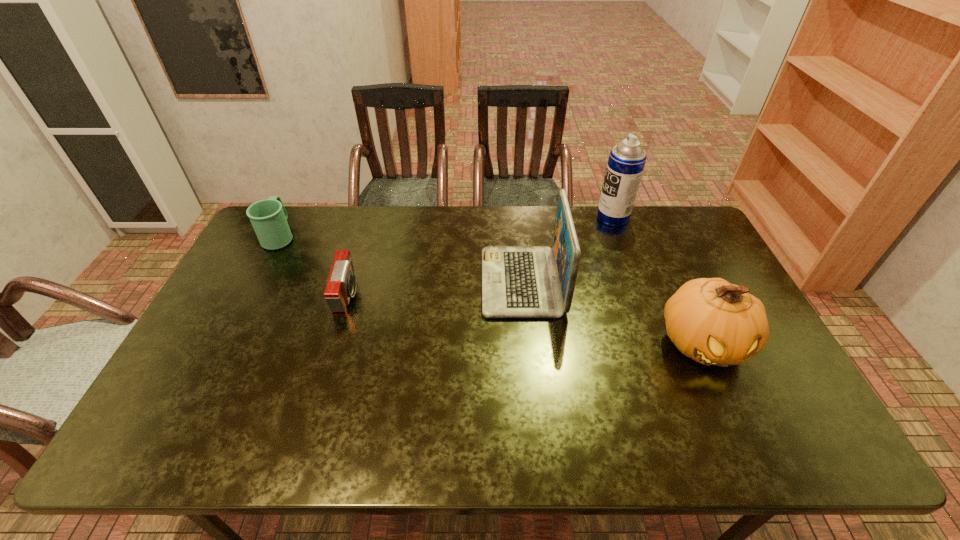
Where is `aerosol can`? This screenshot has height=540, width=960. aerosol can is located at coordinates (626, 162).

You are a GUI agent. You are given a task and a screenshot of the screen. Output one action in this format:
    pyautogui.click(x=<x>, y=<y>)
    Task: Click on the laptop computer
    Image resolution: width=960 pixels, height=540 pixels.
    Given the screenshot: What is the action you would take?
    pyautogui.click(x=517, y=282)

The height and width of the screenshot is (540, 960). Identify the location of pumpkin. (714, 322).

Where is `the second shortest object`? The width and height of the screenshot is (960, 540). the second shortest object is located at coordinates (268, 217).

What are the coordinates of `the leftmost object` in the screenshot? It's located at (268, 217).

Identify the location of the fourth object from right to left. tap(341, 285).

Find the location of a particular element. This screenshot has height=540, width=960. the shortest object is located at coordinates (341, 285).

This screenshot has height=540, width=960. I want to click on blank area located on the label side of the aerosol can, so click(x=510, y=217).

Where is `vacant space situated on the label side of the aerosol can`? vacant space situated on the label side of the aerosol can is located at coordinates (547, 217).

Where is `free space located 0.320m on the label side of the aerosol can`? free space located 0.320m on the label side of the aerosol can is located at coordinates (510, 217).